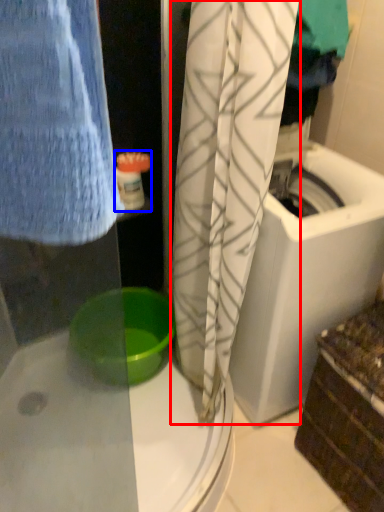
Question: Which point is further to the camera, curtain (highlighted by a red box) or toiletry (highlighted by a blue box)?

Choices:
 (A) curtain
 (B) toiletry

Answer: (B)